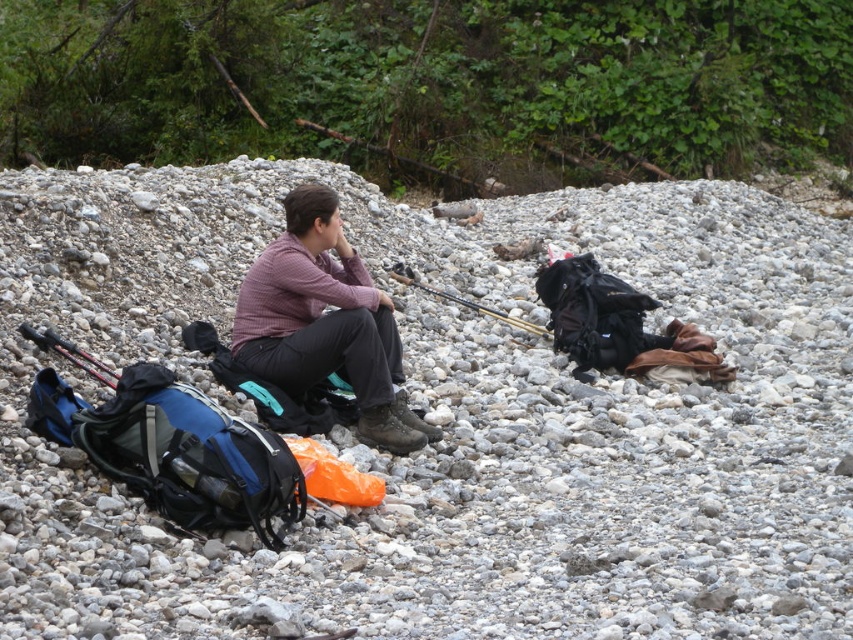
You are a hiker who just arrived at the riverbed. You see the matte purple shirt at center and your camera. How far apart are these two items?

The matte purple shirt at center and camera are 7.72 meters apart from each other.

You are an outdoor enthusiast planning to take a photo of the matte purple shirt at center and the matte black fishing pole at center. Which object should you focus on first if you want to capture both in a single frame without moving the camera?

You should focus on the matte purple shirt at center first because it is larger in size than the matte black fishing pole at center, ensuring it is properly in focus before adjusting for the smaller object.

You are an outdoor enthusiast planning to retrieve your fishing pole. You see the matte purple shirt at center and the matte black fishing pole at center. Which object is positioned to the right side?

The matte black fishing pole at center is positioned to the right of the matte purple shirt at center.